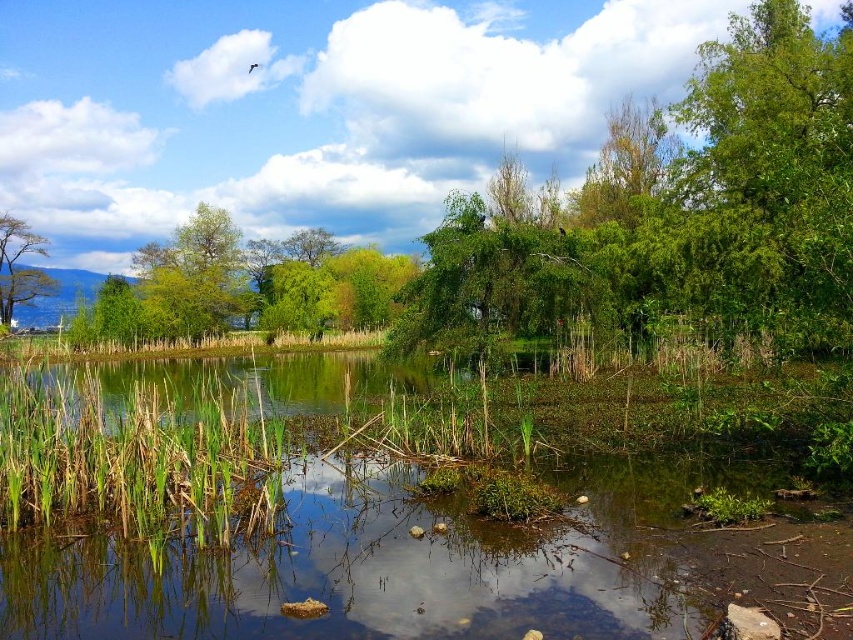
Does green grassy reed at lower left have a smaller size compared to smooth bark tree at upper left?

Yes.

The width and height of the screenshot is (853, 640). I want to click on green grassy reed at lower left, so click(x=135, y=460).

Does point (0, 493) come closer to viewer compared to point (9, 273)?

That is True.

Where is `green grassy reed at lower left`? The height and width of the screenshot is (640, 853). green grassy reed at lower left is located at coordinates (135, 460).